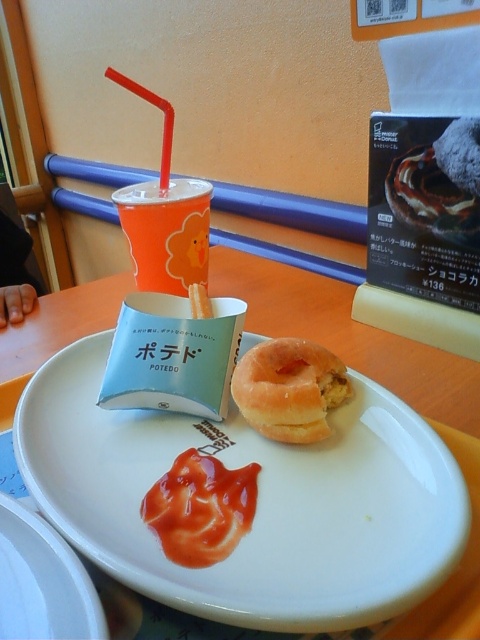
Question: Is white glossy plate at center to the left of smooth white plate at center from the viewer's perspective?

Choices:
 (A) no
 (B) yes

Answer: (A)

Question: Among these objects, which one is nearest to the camera?

Choices:
 (A) smooth white plate at center
 (B) white glossy plate at center

Answer: (A)

Question: Is tomato ketchup at center to the left of glazed doughnut at center from the viewer's perspective?

Choices:
 (A) no
 (B) yes

Answer: (B)

Question: Does smooth white plate at center have a greater width compared to tomato ketchup at center?

Choices:
 (A) no
 (B) yes

Answer: (B)

Question: Which point is farther from the camera taking this photo?

Choices:
 (A) (163, 476)
 (B) (154, 538)
 (C) (24, 525)
 (D) (336, 378)

Answer: (D)

Question: Which point appears farthest from the camera in this image?

Choices:
 (A) (230, 417)
 (B) (346, 392)
 (C) (62, 589)

Answer: (A)